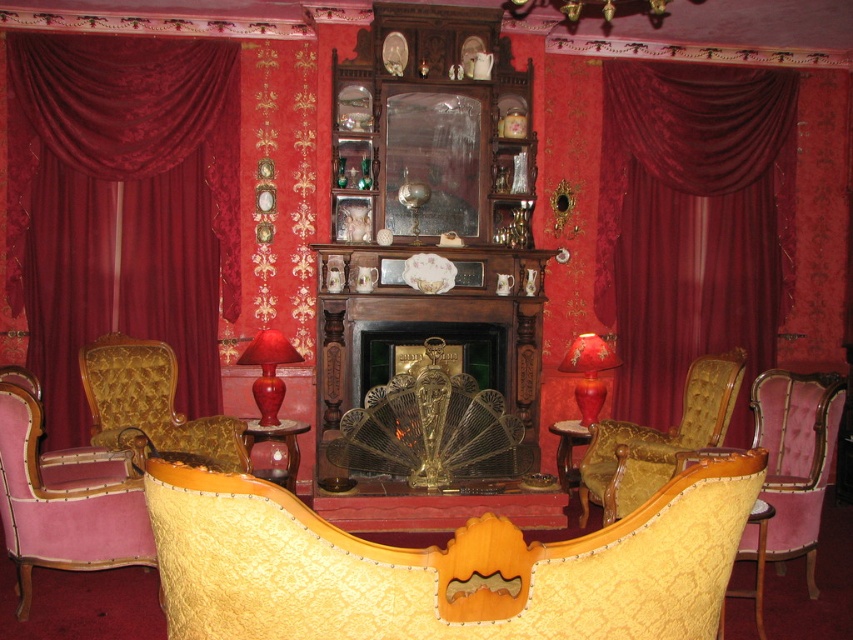
You are standing in the center of the room looking towards the fireplace. There are two points marked in the scene, one at coordinates point (776, 570) and the other at point (264, 385). Which of these points is nearer to you?

Point (776, 570) is closer to the viewer than point (264, 385), so the point at coordinates point (776, 570) is nearer to you.

You are planning to place a new small decorative item on the mantelpiece in the room. Given the velvet pink armchair at center and the shiny red glass lamp at center, which object can you place the item on?

The shiny red glass lamp at center is smaller than the velvet pink armchair at center, so you can place the new decorative item on the shiny red glass lamp at center.